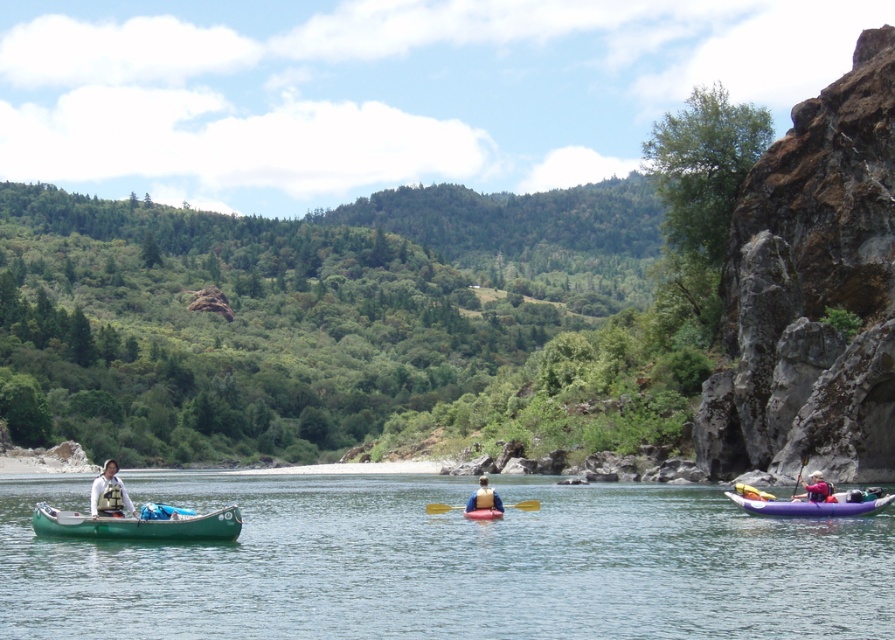
Is green matte canoe at left taller than matte yellow life vest at center?

No, green matte canoe at left is not taller than matte yellow life vest at center.

How much distance is there between green matte canoe at left and matte yellow life vest at center?

The distance of green matte canoe at left from matte yellow life vest at center is 64.72 feet.

Is point (142, 518) in front of point (476, 508)?

Yes, it is in front of point (476, 508).

The image size is (895, 640). What are the coordinates of `green matte canoe at left` in the screenshot? It's located at (138, 525).

Image resolution: width=895 pixels, height=640 pixels. Find the location of `purple inflatable kayak at right`. purple inflatable kayak at right is located at coordinates (813, 506).

You are a GUI agent. You are given a task and a screenshot of the screen. Output one action in this format:
    pyautogui.click(x=<x>, y=<y>)
    Task: Click on the purple inflatable kayak at right
    The width and height of the screenshot is (895, 640).
    Given the screenshot: What is the action you would take?
    pyautogui.click(x=813, y=506)

Who is more forward, (868, 628) or (470, 515)?

Point (868, 628)

Who is more distant from viewer, (878,586) or (499,515)?

The point (499,515) is more distant.

Is point (662, 548) in front of point (484, 508)?

Yes, point (662, 548) is closer to viewer.

Where is `green rubber canoe at left`? This screenshot has width=895, height=640. green rubber canoe at left is located at coordinates (442, 563).